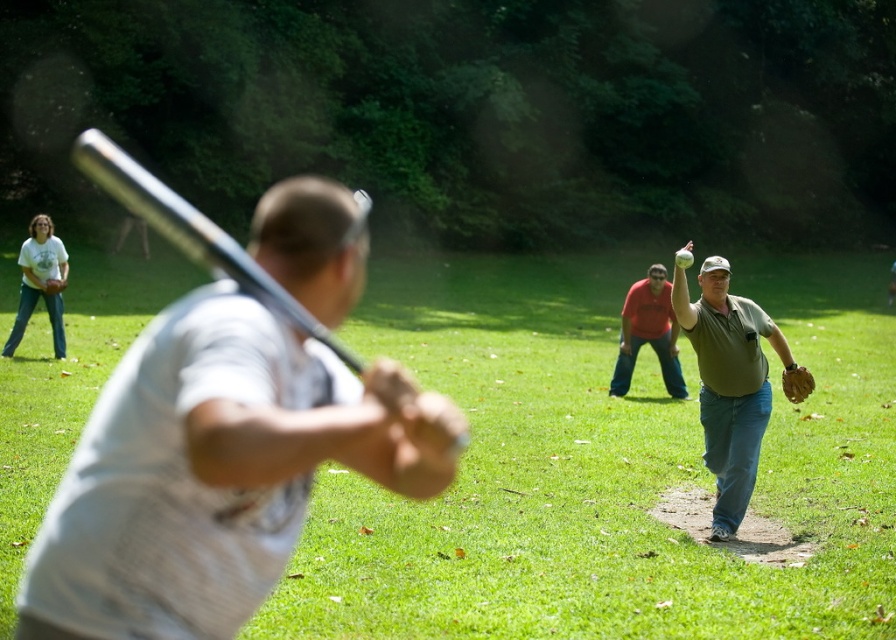
Question: Considering the real-world distances, which object is farthest from the matte white t-shirt at left?

Choices:
 (A) matte red shirt at center
 (B) green matte baseball glove at right

Answer: (B)

Question: Is matte red shirt at center to the right of brown leather baseball glove at upper left from the viewer's perspective?

Choices:
 (A) yes
 (B) no

Answer: (A)

Question: Where is matte red shirt at center located in relation to brown leather baseball glove at right in the image?

Choices:
 (A) below
 (B) above

Answer: (B)

Question: Is matte red shirt at center below matte white t-shirt at left?

Choices:
 (A) yes
 (B) no

Answer: (A)

Question: Which point is farther from the camera taking this photo?

Choices:
 (A) (799, 388)
 (B) (61, 285)

Answer: (B)

Question: Estimate the real-world distances between objects in this image. Which object is closer to the matte red shirt at center?

Choices:
 (A) brown leather baseball glove at upper left
 (B) green matte baseball glove at right
 (C) white matte bat at center

Answer: (B)